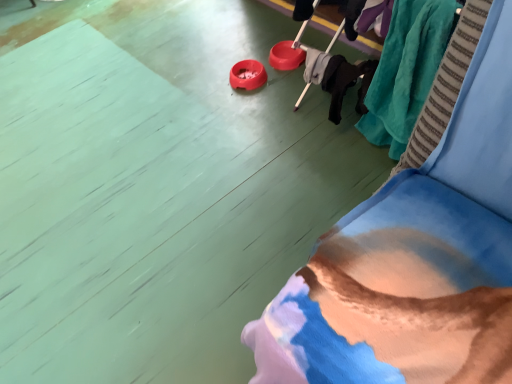
Question: Does velvet blue couch at lower right have a smaller size compared to teal plush blanket at upper right?

Choices:
 (A) no
 (B) yes

Answer: (A)

Question: Can you confirm if velvet blue couch at lower right is shorter than teal plush blanket at upper right?

Choices:
 (A) no
 (B) yes

Answer: (B)

Question: Considering the relative positions of velvet blue couch at lower right and teal plush blanket at upper right in the image provided, is velvet blue couch at lower right to the left of teal plush blanket at upper right from the viewer's perspective?

Choices:
 (A) no
 (B) yes

Answer: (B)

Question: Is velvet blue couch at lower right next to teal plush blanket at upper right?

Choices:
 (A) yes
 (B) no

Answer: (B)

Question: Could teal plush blanket at upper right be considered to be inside velvet blue couch at lower right?

Choices:
 (A) no
 (B) yes

Answer: (A)

Question: Is velvet blue couch at lower right wider than teal plush blanket at upper right?

Choices:
 (A) yes
 (B) no

Answer: (A)

Question: Considering the relative sizes of teal plush blanket at upper right and velvet blue couch at lower right in the image provided, is teal plush blanket at upper right bigger than velvet blue couch at lower right?

Choices:
 (A) yes
 (B) no

Answer: (B)

Question: Is teal plush blanket at upper right to the right of velvet blue couch at lower right from the viewer's perspective?

Choices:
 (A) yes
 (B) no

Answer: (A)

Question: Can you confirm if teal plush blanket at upper right is shorter than velvet blue couch at lower right?

Choices:
 (A) no
 (B) yes

Answer: (A)

Question: Is teal plush blanket at upper right thinner than velvet blue couch at lower right?

Choices:
 (A) no
 (B) yes

Answer: (B)

Question: From the image's perspective, is teal plush blanket at upper right below velvet blue couch at lower right?

Choices:
 (A) yes
 (B) no

Answer: (A)

Question: Is teal plush blanket at upper right positioned behind velvet blue couch at lower right?

Choices:
 (A) yes
 (B) no

Answer: (A)

Question: Considering the positions of velvet blue couch at lower right and teal plush blanket at upper right in the image, is velvet blue couch at lower right wider or thinner than teal plush blanket at upper right?

Choices:
 (A) thin
 (B) wide

Answer: (B)